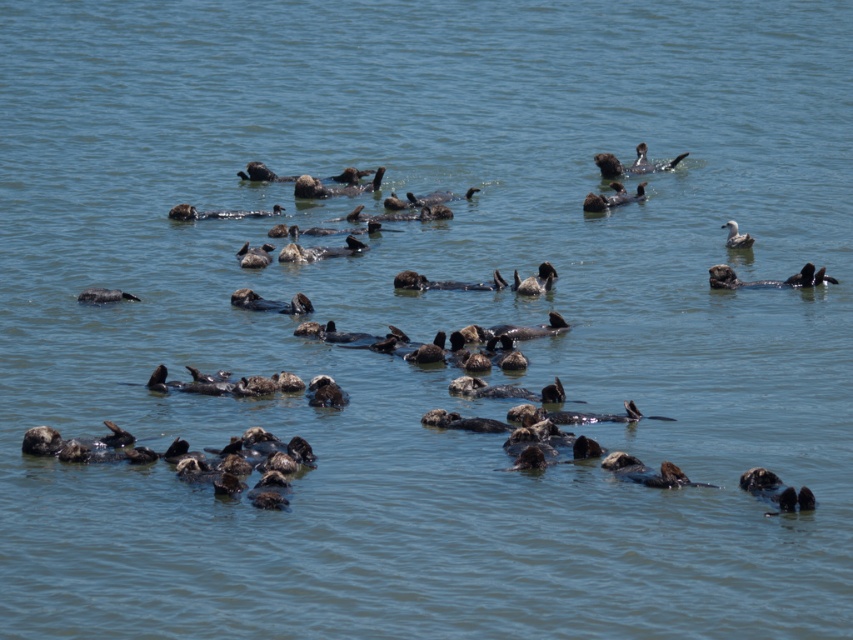
Is dark brown duck at center bigger than white fluffy duck at upper right?

Yes.

Which is more to the left, dark brown duck at center or white fluffy duck at upper right?

dark brown duck at center

Image resolution: width=853 pixels, height=640 pixels. Find the location of `dark brown duck at center`. dark brown duck at center is located at coordinates (254, 256).

What are the coordinates of `dark brown duck at center` in the screenshot? It's located at (254, 256).

Looking at this image, between dark brown fuzzy duck at center and white fluffy duck at upper right, which one appears on the left side from the viewer's perspective?

dark brown fuzzy duck at center

Is dark brown fuzzy duck at center to the left of white fluffy duck at upper right from the viewer's perspective?

Correct, you'll find dark brown fuzzy duck at center to the left of white fluffy duck at upper right.

Based on the photo, who is more forward, (534,276) or (734,243)?

Point (534,276) is more forward.

Locate an element on the screen. Image resolution: width=853 pixels, height=640 pixels. dark brown fuzzy duck at center is located at coordinates (537, 280).

Can you confirm if dark brown fur seal at right is positioned below white fluffy duck at upper right?

Indeed, dark brown fur seal at right is positioned under white fluffy duck at upper right.

Locate an element on the screen. This screenshot has width=853, height=640. dark brown fur seal at right is located at coordinates (767, 280).